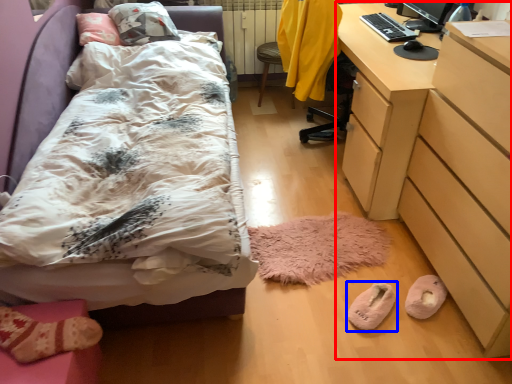
Question: Among these objects, which one is farthest to the camera, desk (highlighted by a red box) or footwear (highlighted by a blue box)?

Choices:
 (A) desk
 (B) footwear

Answer: (B)